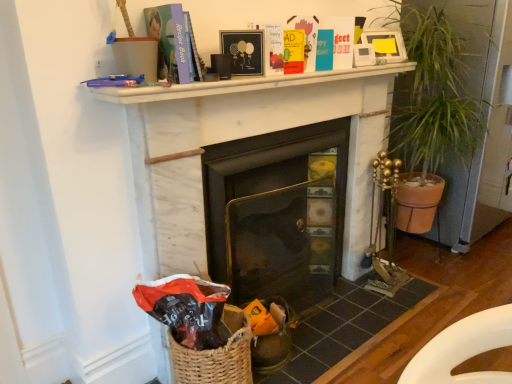
Question: Is woven brown basket at lower left facing away from green leafy plant at right?

Choices:
 (A) yes
 (B) no

Answer: (B)

Question: From a real-world perspective, is woven brown basket at lower left on top of green leafy plant at right?

Choices:
 (A) yes
 (B) no

Answer: (B)

Question: Is woven brown basket at lower left smaller than green leafy plant at right?

Choices:
 (A) no
 (B) yes

Answer: (B)

Question: Does woven brown basket at lower left have a larger size compared to green leafy plant at right?

Choices:
 (A) no
 (B) yes

Answer: (A)

Question: Is the depth of woven brown basket at lower left less than that of green leafy plant at right?

Choices:
 (A) no
 (B) yes

Answer: (B)

Question: From the image's perspective, is white marble fireplace at center, which appears as the second fireplace when viewed from the left, positioned above or below yellow matte paperback book at upper center, acting as the 2th paperback book starting from the front?

Choices:
 (A) below
 (B) above

Answer: (A)

Question: Is point (169, 264) positioned closer to the camera than point (295, 39)?

Choices:
 (A) farther
 (B) closer

Answer: (B)

Question: Visually, is white marble fireplace at center, marked as the 1th fireplace in a right-to-left arrangement, positioned to the left or to the right of yellow matte paperback book at upper center, positioned as the second paperback book in left-to-right order?

Choices:
 (A) left
 (B) right

Answer: (A)

Question: Would you say white marble fireplace at center, marked as the 1th fireplace in a right-to-left arrangement, is inside or outside yellow matte paperback book at upper center, the first paperback book positioned from the right?

Choices:
 (A) inside
 (B) outside

Answer: (B)

Question: Considering the positions of woven basket at lower left and black matte picture frame at upper center, positioned as the first picture frame in bottom-to-top order, in the image, is woven basket at lower left wider or thinner than black matte picture frame at upper center, positioned as the first picture frame in bottom-to-top order,?

Choices:
 (A) thin
 (B) wide

Answer: (B)

Question: Considering the positions of point (388, 309) and point (228, 34), is point (388, 309) closer or farther from the camera than point (228, 34)?

Choices:
 (A) closer
 (B) farther

Answer: (B)

Question: Considering the positions of woven basket at lower left and black matte picture frame at upper center, the 1th picture frame in the front-to-back sequence, in the image, is woven basket at lower left taller or shorter than black matte picture frame at upper center, the 1th picture frame in the front-to-back sequence,?

Choices:
 (A) tall
 (B) short

Answer: (B)

Question: In the image, is woven basket at lower left positioned in front of or behind black matte picture frame at upper center, positioned as the first picture frame in bottom-to-top order?

Choices:
 (A) behind
 (B) front

Answer: (B)

Question: Is point (455, 69) closer or farther from the camera than point (229, 39)?

Choices:
 (A) farther
 (B) closer

Answer: (A)

Question: From a real-world perspective, is green leafy plant at right positioned above or below black matte picture frame at upper center, positioned as the first picture frame in bottom-to-top order?

Choices:
 (A) below
 (B) above

Answer: (A)